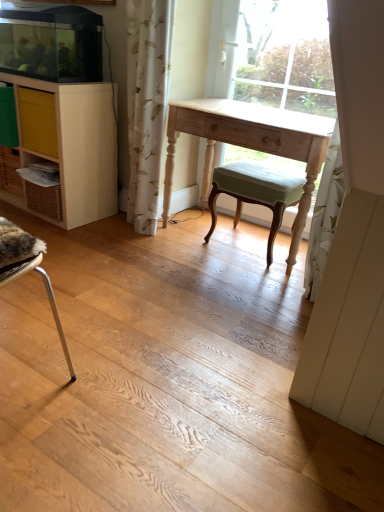
Question: Is light wood desk at center thinner than light green fabric stool at center?

Choices:
 (A) no
 (B) yes

Answer: (B)

Question: Is light wood desk at center further to camera compared to light green fabric stool at center?

Choices:
 (A) yes
 (B) no

Answer: (B)

Question: Is light wood desk at center facing towards light green fabric stool at center?

Choices:
 (A) no
 (B) yes

Answer: (B)

Question: Is light wood desk at center wider than light green fabric stool at center?

Choices:
 (A) no
 (B) yes

Answer: (A)

Question: Is light wood desk at center smaller than light green fabric stool at center?

Choices:
 (A) no
 (B) yes

Answer: (A)

Question: Does point (21, 133) appear closer or farther from the camera than point (243, 70)?

Choices:
 (A) closer
 (B) farther

Answer: (A)

Question: Looking at their shapes, would you say light wood cabinet at left is wider or thinner than light wood desk at center?

Choices:
 (A) wide
 (B) thin

Answer: (A)

Question: Considering the positions of light wood cabinet at left and light wood desk at center in the image, is light wood cabinet at left taller or shorter than light wood desk at center?

Choices:
 (A) short
 (B) tall

Answer: (A)

Question: From a real-world perspective, is light wood cabinet at left above or below light wood desk at center?

Choices:
 (A) above
 (B) below

Answer: (B)

Question: In terms of width, does light wood cabinet at left look wider or thinner when compared to white floral fabric curtain at center?

Choices:
 (A) wide
 (B) thin

Answer: (A)

Question: Looking at the image, does light wood cabinet at left seem bigger or smaller compared to white floral fabric curtain at center?

Choices:
 (A) big
 (B) small

Answer: (A)

Question: From a real-world perspective, relative to white floral fabric curtain at center, is light wood cabinet at left vertically above or below?

Choices:
 (A) below
 (B) above

Answer: (A)

Question: Considering their positions, is light wood cabinet at left located in front of or behind white floral fabric curtain at center?

Choices:
 (A) behind
 (B) front

Answer: (A)

Question: From a real-world perspective, is light wood desk at center physically located above or below light wood desk at center?

Choices:
 (A) above
 (B) below

Answer: (A)

Question: Which is correct: light wood desk at center is inside light wood desk at center, or outside of it?

Choices:
 (A) inside
 (B) outside

Answer: (B)